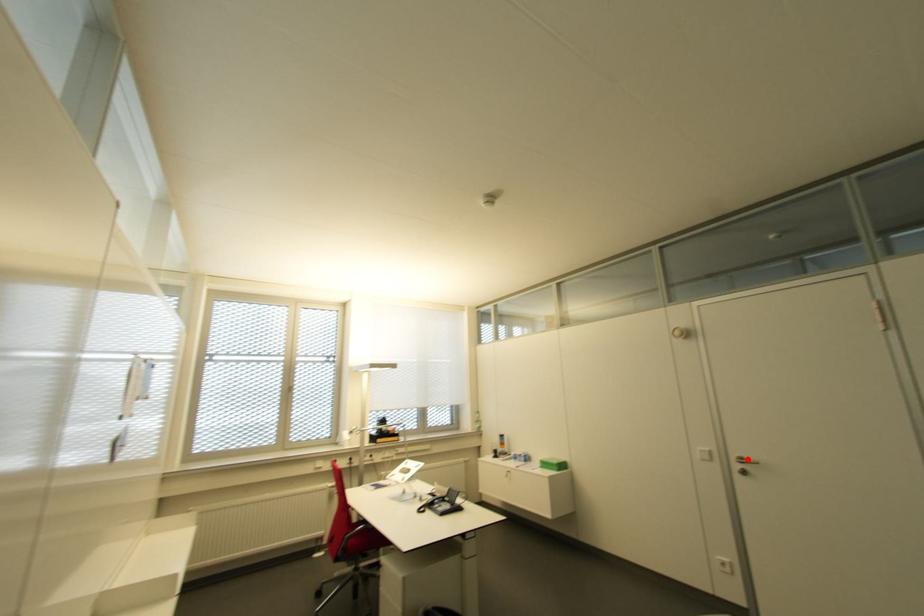
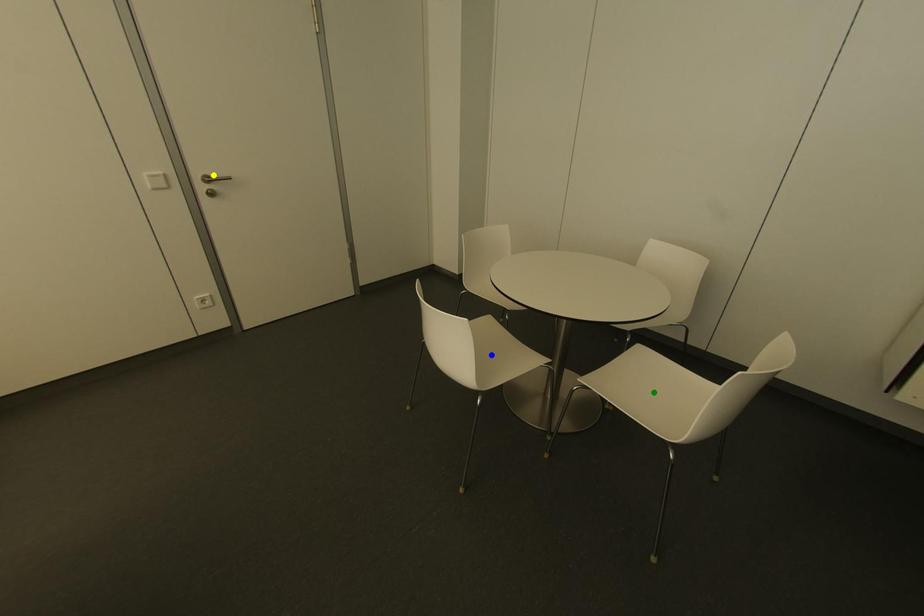
Question: I am providing you with two images of the same scene from different viewpoints. A red point is marked on the first image. You are given multiple points on the second image. In image 2, which mark is for the same physical point as the one in image 1?

Choices:
 (A) green point
 (B) blue point
 (C) yellow point

Answer: (C)